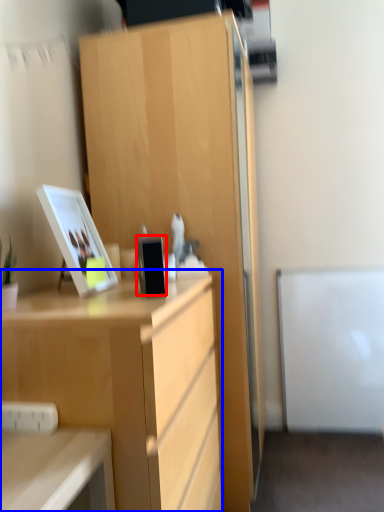
Question: Which object appears farthest to the camera in this image, appliance (highlighted by a red box) or desk (highlighted by a blue box)?

Choices:
 (A) appliance
 (B) desk

Answer: (A)